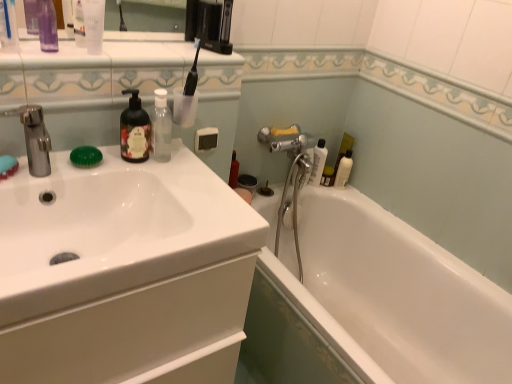
Question: Is clear plastic bottle at upper left, which ranks as the second mouthwash in right-to-left order, not within white glossy bottle at upper right, which ranks as the 2th toiletry in right-to-left order?

Choices:
 (A) no
 (B) yes

Answer: (B)

Question: Can you confirm if clear plastic bottle at upper left, positioned as the 1th mouthwash in left-to-right order, is taller than white glossy bottle at upper right, the 2th toiletry viewed from the back?

Choices:
 (A) no
 (B) yes

Answer: (A)

Question: Does clear plastic bottle at upper left, acting as the first mouthwash starting from the top, have a greater width compared to white glossy bottle at upper right, which ranks as the 2th toiletry in right-to-left order?

Choices:
 (A) no
 (B) yes

Answer: (A)

Question: Can you confirm if clear plastic bottle at upper left, marked as the second mouthwash in a bottom-to-top arrangement, is smaller than white glossy bottle at upper right, the third toiletry in the left-to-right sequence?

Choices:
 (A) yes
 (B) no

Answer: (A)

Question: Is clear plastic bottle at upper left, which ranks as the second mouthwash in right-to-left order, positioned far away from white glossy bottle at upper right, the third toiletry in the left-to-right sequence?

Choices:
 (A) no
 (B) yes

Answer: (B)

Question: From the image's perspective, is white glossy bathtub at lower right above or below white glossy bottle at right, arranged as the 1th toiletry when viewed from the right?

Choices:
 (A) below
 (B) above

Answer: (A)

Question: Based on their positions, is white glossy bathtub at lower right located to the left or right of white glossy bottle at right, which is the first toiletry in back-to-front order?

Choices:
 (A) right
 (B) left

Answer: (B)

Question: From their relative heights in the image, would you say white glossy bathtub at lower right is taller or shorter than white glossy bottle at right, which ranks as the 4th toiletry in front-to-back order?

Choices:
 (A) tall
 (B) short

Answer: (A)

Question: In terms of width, does white glossy bathtub at lower right look wider or thinner when compared to white glossy bottle at right, which is the fourth toiletry in left-to-right order?

Choices:
 (A) thin
 (B) wide

Answer: (B)

Question: Is transparent plastic bottle at upper center, the 2th mouthwash when ordered from top to bottom, wider or thinner than matte black soap dispenser at upper left?

Choices:
 (A) thin
 (B) wide

Answer: (A)

Question: Based on their positions, is transparent plastic bottle at upper center, the 2th mouthwash from the left, located to the left or right of matte black soap dispenser at upper left?

Choices:
 (A) left
 (B) right

Answer: (B)

Question: Is point (169, 129) positioned closer to the camera than point (120, 125)?

Choices:
 (A) closer
 (B) farther

Answer: (B)

Question: From their relative heights in the image, would you say transparent plastic bottle at upper center, the 2th mouthwash when ordered from top to bottom, is taller or shorter than matte black soap dispenser at upper left?

Choices:
 (A) tall
 (B) short

Answer: (A)

Question: In the image, is clear plastic bottle at upper left, which ranks as the second mouthwash in right-to-left order, positioned in front of or behind transparent plastic bottle at upper center, the 2th mouthwash when ordered from top to bottom?

Choices:
 (A) front
 (B) behind

Answer: (A)

Question: Based on their sizes in the image, would you say clear plastic bottle at upper left, positioned as the 1th mouthwash in left-to-right order, is bigger or smaller than transparent plastic bottle at upper center, the 1th mouthwash from the bottom?

Choices:
 (A) big
 (B) small

Answer: (B)